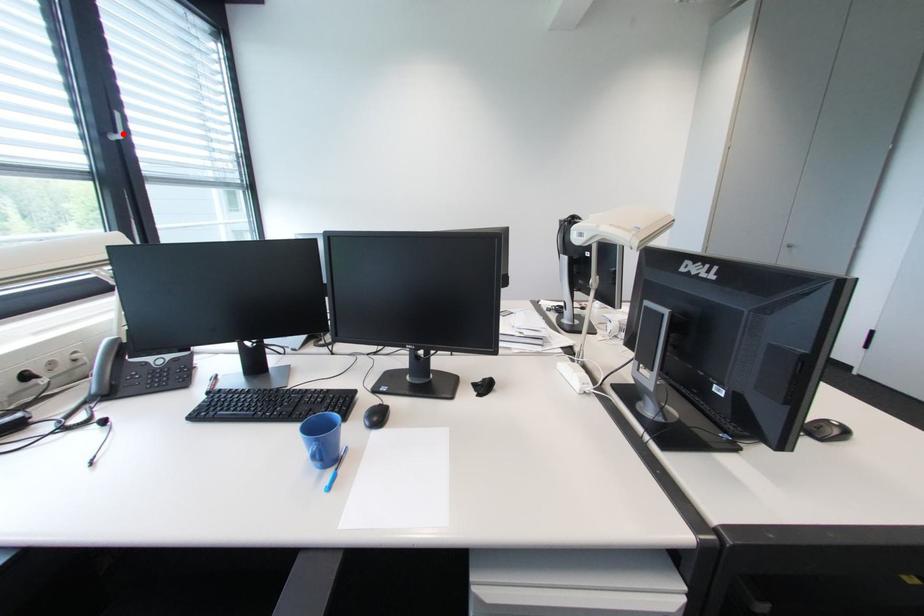
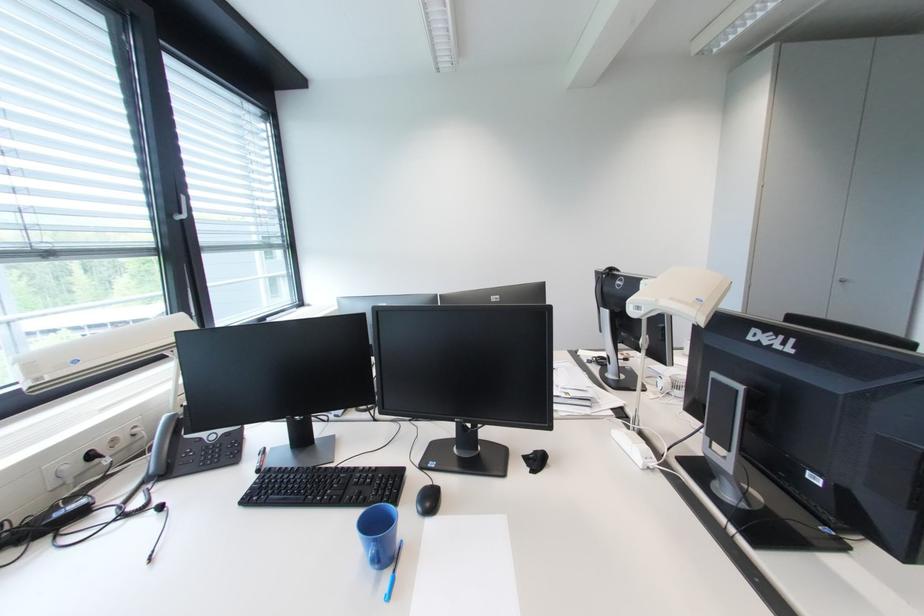
Find the pixel in the second image that matches the highlighted location in the first image.

(188, 215)